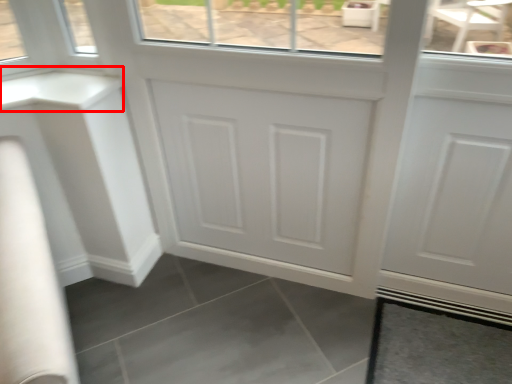
Question: Observing the image, what is the correct spatial positioning of counter top (annotated by the red box) in reference to tile?

Choices:
 (A) right
 (B) left

Answer: (B)